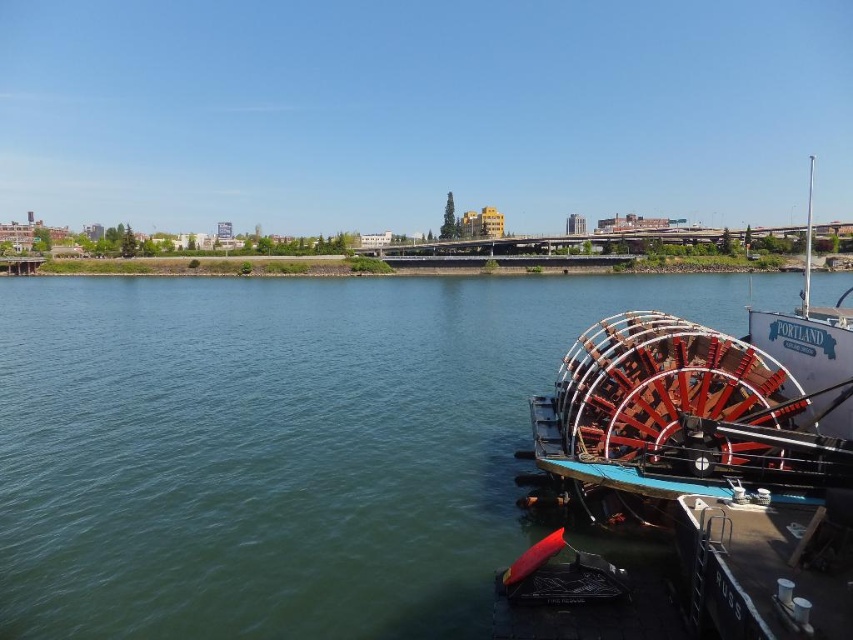
Identify the location of green smooth water at lower left. The image size is (853, 640). (283, 445).

Between green smooth water at lower left and red polished wood paddlewheel at right, which one has more height?

With more height is green smooth water at lower left.

Who is more forward, (326, 611) or (618, 461)?

Point (326, 611) is more forward.

Find the location of `green smooth water at lower left`. green smooth water at lower left is located at coordinates (283, 445).